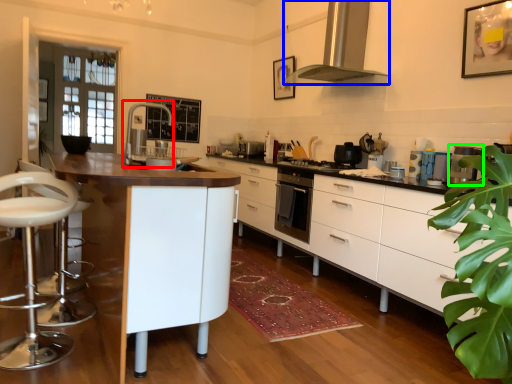
Question: Which is nearer to the faucet (highlighted by a red box)? home appliance (highlighted by a blue box) or kitchen appliance (highlighted by a green box).

Choices:
 (A) home appliance
 (B) kitchen appliance

Answer: (A)